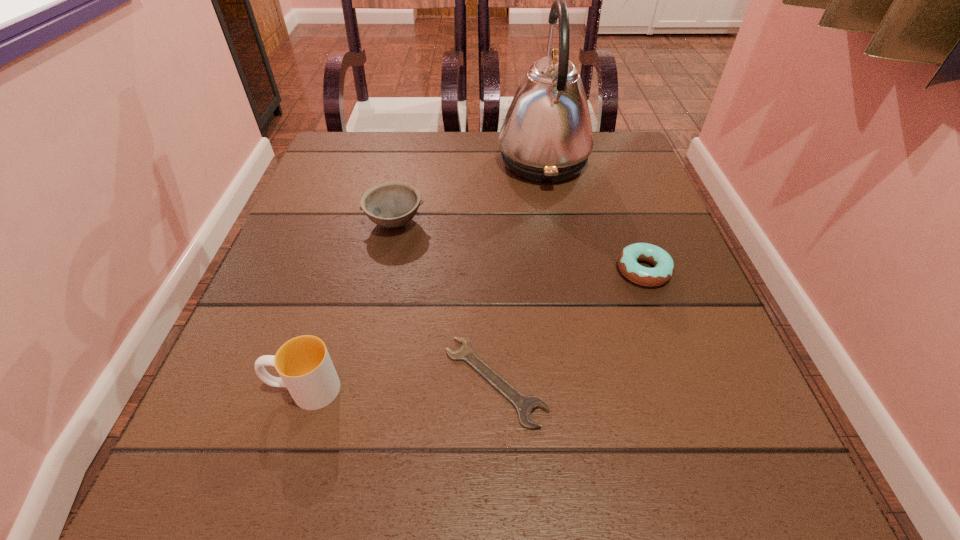
Identify the location of the farthest object. (546, 137).

Locate an element on the screen. the tallest object is located at coordinates [x=546, y=137].

The height and width of the screenshot is (540, 960). Identify the location of the fourth shortest object. (304, 365).

Image resolution: width=960 pixels, height=540 pixels. Identify the location of bowl. point(392,204).

Where is `the second farthest object`? This screenshot has height=540, width=960. the second farthest object is located at coordinates (392, 204).

Where is `doughnut`? The image size is (960, 540). doughnut is located at coordinates (664, 268).

Where is `the second shortest object`? the second shortest object is located at coordinates (664, 268).

Locate an element on the screen. Image resolution: width=960 pixels, height=540 pixels. wrench is located at coordinates (524, 405).

I want to click on vacant point located 0.340m from the spout of the tallest object, so click(x=357, y=162).

You are a GUI agent. You are given a task and a screenshot of the screen. Output one action in this format:
    pyautogui.click(x=<x>, y=<y>)
    Task: Click on the free location located 0.320m from the spout of the tallest object
    The width and height of the screenshot is (960, 540).
    Given the screenshot: What is the action you would take?
    pyautogui.click(x=365, y=162)